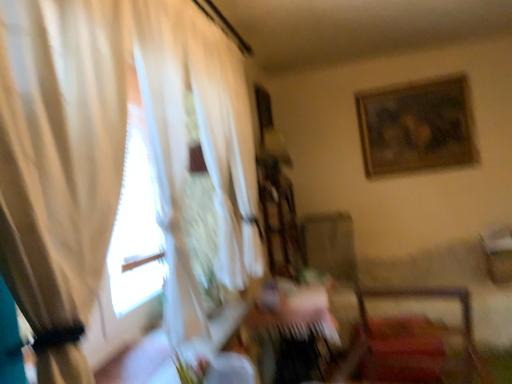
The image size is (512, 384). What do you see at coordinates (115, 150) in the screenshot?
I see `white sheer curtain at left` at bounding box center [115, 150].

This screenshot has height=384, width=512. Describe the element at coordinates (417, 341) in the screenshot. I see `velvet red chair at lower right` at that location.

Where is `white sheer curtain at left`? The image size is (512, 384). white sheer curtain at left is located at coordinates (115, 150).

Considering the relative positions of white sheer curtain at left and velvet red chair at lower right in the image provided, is white sheer curtain at left to the left or to the right of velvet red chair at lower right?

From the image, it's evident that white sheer curtain at left is to the left of velvet red chair at lower right.

Is white sheer curtain at left with velvet red chair at lower right?

There is a gap between white sheer curtain at left and velvet red chair at lower right.

Is point (28, 56) positioned in front of point (373, 370)?

Yes.

How different are the orientations of white sheer curtain at left and velvet red chair at lower right in degrees?

They differ by 98.7 degrees in their facing directions.

Is velvet red chair at lower right directly adjacent to wooden table at center?

No, velvet red chair at lower right is not with wooden table at center.

Who is bigger, velvet red chair at lower right or wooden table at center?

wooden table at center is bigger.

Is wooden table at center completely or partially inside velvet red chair at lower right?

No, wooden table at center is not a part of velvet red chair at lower right.

From a real-world perspective, is wooden table at center positioned under wooden framed artwork at upper right based on gravity?

Indeed, from a real-world perspective, wooden table at center is positioned beneath wooden framed artwork at upper right.

Considering the sizes of objects wooden table at center and wooden framed artwork at upper right in the image provided, who is wider, wooden table at center or wooden framed artwork at upper right?

With larger width is wooden table at center.

How many degrees apart are the facing directions of wooden table at center and wooden framed artwork at upper right?

There is a 91.2-degree angle between the facing directions of wooden table at center and wooden framed artwork at upper right.

From the image's perspective, between wooden table at center and wooden framed artwork at upper right, who is located below?

wooden table at center appears lower in the image.

From the picture: Between white sheer curtain at left and wooden framed artwork at upper right, which one has smaller width?

wooden framed artwork at upper right is thinner.

Considering the relative positions of white sheer curtain at left and wooden framed artwork at upper right in the image provided, is white sheer curtain at left to the right of wooden framed artwork at upper right from the viewer's perspective?

In fact, white sheer curtain at left is to the left of wooden framed artwork at upper right.

In terms of height, does white sheer curtain at left look taller or shorter compared to wooden framed artwork at upper right?

Considering their sizes, white sheer curtain at left has more height than wooden framed artwork at upper right.

Is wooden framed artwork at upper right inside or outside of wooden table at center?

The correct answer is: outside.

Can you confirm if wooden framed artwork at upper right is taller than wooden table at center?

Indeed, wooden framed artwork at upper right has a greater height compared to wooden table at center.

Based on their sizes in the image, would you say wooden framed artwork at upper right is bigger or smaller than wooden table at center?

wooden framed artwork at upper right is smaller than wooden table at center.

From a real-world perspective, is white sheer curtain at left below wooden table at center?

No, from a real-world perspective, white sheer curtain at left is not under wooden table at center.

Does point (64, 93) come behind point (303, 338)?

No, (64, 93) is in front of (303, 338).

Find the location of a particular element. The image size is (512, 384). curtain on the left of wooden table at center is located at coordinates (115, 150).

Which object is thinner, white sheer curtain at left or wooden table at center?

With smaller width is white sheer curtain at left.

Between wooden table at center and velvet red chair at lower right, which one has smaller size?

velvet red chair at lower right is smaller.

In the image, is wooden table at center positioned in front of or behind velvet red chair at lower right?

wooden table at center is behind velvet red chair at lower right.

You are a GUI agent. You are given a task and a screenshot of the screen. Output one action in this format:
    pyautogui.click(x=<x>, y=<y>)
    Task: Click on the table below the velvet red chair at lower right (from a real-world perspective)
    Image resolution: width=512 pixels, height=384 pixels.
    Given the screenshot: What is the action you would take?
    pyautogui.click(x=293, y=325)

The image size is (512, 384). I want to click on curtain on the left of the velvet red chair at lower right, so click(115, 150).

Find the location of a particular element. table lying behind the velvet red chair at lower right is located at coordinates (293, 325).

Considering their positions, is wooden table at center positioned further to velvet red chair at lower right than wooden framed artwork at upper right?

wooden framed artwork at upper right is positioned further to the anchor velvet red chair at lower right.

Considering their positions, is white sheer curtain at left positioned closer to wooden framed artwork at upper right than wooden table at center?

wooden table at center.

When comparing their distances from velvet red chair at lower right, does white sheer curtain at left or wooden framed artwork at upper right seem closer?

Based on the image, wooden framed artwork at upper right appears to be nearer to velvet red chair at lower right.

Considering their positions, is velvet red chair at lower right positioned further to wooden table at center than white sheer curtain at left?

white sheer curtain at left lies further to wooden table at center than the other object.

From the image, which object appears to be farther from wooden framed artwork at upper right, white sheer curtain at left or velvet red chair at lower right?

Among the two, white sheer curtain at left is located further to wooden framed artwork at upper right.

Looking at the image, which one is located further to white sheer curtain at left, wooden table at center or velvet red chair at lower right?

The object further to white sheer curtain at left is velvet red chair at lower right.

From the image, which object appears to be farther from white sheer curtain at left, wooden framed artwork at upper right or wooden table at center?

wooden framed artwork at upper right is further to white sheer curtain at left.

Estimate the real-world distances between objects in this image. Which object is further from white sheer curtain at left, velvet red chair at lower right or wooden table at center?

velvet red chair at lower right is positioned further to the anchor white sheer curtain at left.

Where is `chair located between white sheer curtain at left and wooden framed artwork at upper right in the depth direction`? The height and width of the screenshot is (384, 512). chair located between white sheer curtain at left and wooden framed artwork at upper right in the depth direction is located at coordinates (417, 341).

The image size is (512, 384). Find the location of `table located between white sheer curtain at left and wooden framed artwork at upper right in the depth direction`. table located between white sheer curtain at left and wooden framed artwork at upper right in the depth direction is located at coordinates (293, 325).

You are a GUI agent. You are given a task and a screenshot of the screen. Output one action in this format:
    pyautogui.click(x=<x>, y=<y>)
    Task: Click on the chair located between white sheer curtain at left and wooden table at center in the depth direction
    This screenshot has width=512, height=384.
    Given the screenshot: What is the action you would take?
    pyautogui.click(x=417, y=341)

You are a GUI agent. You are given a task and a screenshot of the screen. Output one action in this format:
    pyautogui.click(x=<x>, y=<y>)
    Task: Click on the table located between velvet red chair at lower right and wooden framed artwork at upper right in the depth direction
    This screenshot has width=512, height=384.
    Given the screenshot: What is the action you would take?
    pyautogui.click(x=293, y=325)